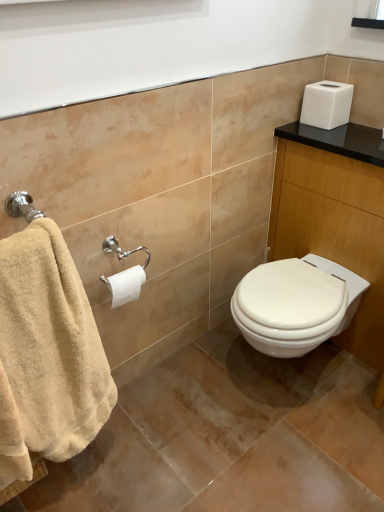
Question: Does white glossy vanity at upper right appear on the left side of white matte toilet paper at center left?

Choices:
 (A) yes
 (B) no

Answer: (B)

Question: Is there a large distance between white glossy vanity at upper right and white matte toilet paper at center left?

Choices:
 (A) no
 (B) yes

Answer: (A)

Question: Is white glossy vanity at upper right turned away from white matte toilet paper at center left?

Choices:
 (A) no
 (B) yes

Answer: (A)

Question: From the image's perspective, is white glossy vanity at upper right below white matte toilet paper at center left?

Choices:
 (A) no
 (B) yes

Answer: (A)

Question: From a real-world perspective, is white glossy vanity at upper right positioned over white matte toilet paper at center left based on gravity?

Choices:
 (A) yes
 (B) no

Answer: (B)

Question: Can you confirm if white glossy vanity at upper right is positioned to the right of white matte toilet paper at center left?

Choices:
 (A) yes
 (B) no

Answer: (A)

Question: Does white glossy vanity at upper right turn towards beige cotton towel at left?

Choices:
 (A) no
 (B) yes

Answer: (B)

Question: Can you confirm if white glossy vanity at upper right is wider than beige cotton towel at left?

Choices:
 (A) no
 (B) yes

Answer: (B)

Question: Does white glossy vanity at upper right lie behind beige cotton towel at left?

Choices:
 (A) no
 (B) yes

Answer: (B)

Question: Considering the relative sizes of white glossy vanity at upper right and beige cotton towel at left in the image provided, is white glossy vanity at upper right thinner than beige cotton towel at left?

Choices:
 (A) no
 (B) yes

Answer: (A)

Question: Is white glossy vanity at upper right at the right side of beige cotton towel at left?

Choices:
 (A) no
 (B) yes

Answer: (B)

Question: Would you consider white glossy vanity at upper right to be distant from beige cotton towel at left?

Choices:
 (A) yes
 (B) no

Answer: (A)

Question: From a real-world perspective, does beige cotton towel at left stand above white glossy vanity at upper right?

Choices:
 (A) no
 (B) yes

Answer: (B)